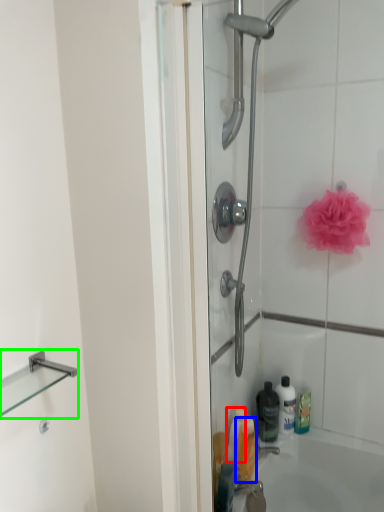
Question: Considering the real-world distances, which object is closest to cleaning product (highlighted by a red box)? toiletry (highlighted by a blue box) or balustrade (highlighted by a green box).

Choices:
 (A) toiletry
 (B) balustrade

Answer: (A)